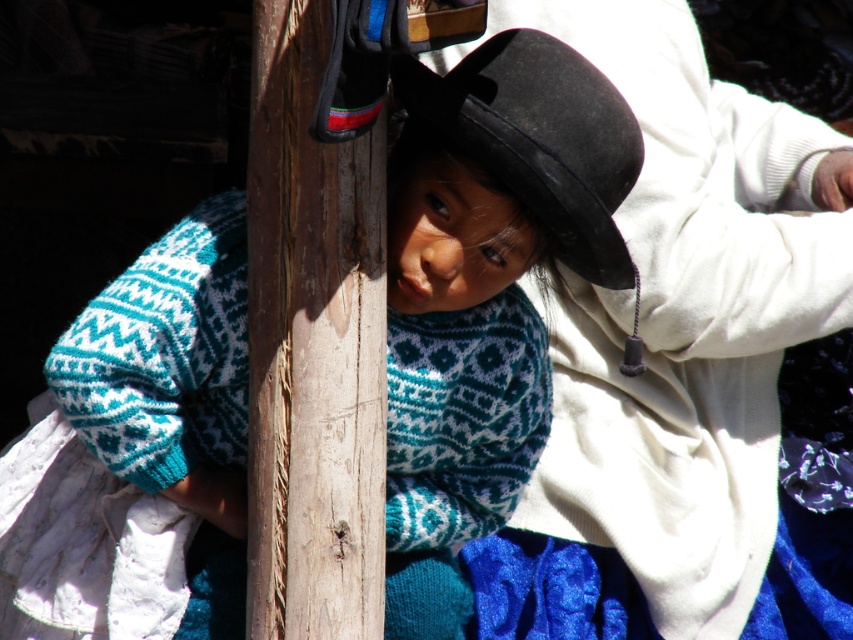
Is knitted wool sweater at center bigger than wooden pole at center?

Yes, knitted wool sweater at center is bigger than wooden pole at center.

What do you see at coordinates (485, 291) in the screenshot? I see `knitted wool sweater at center` at bounding box center [485, 291].

Locate an element on the screen. Image resolution: width=853 pixels, height=640 pixels. knitted wool sweater at center is located at coordinates (485, 291).

Based on the photo, is wooden pole at center below black felt hat at center?

Yes, wooden pole at center is below black felt hat at center.

Is wooden pole at center smaller than black felt hat at center?

Incorrect, wooden pole at center is not smaller in size than black felt hat at center.

Describe the element at coordinates (312, 346) in the screenshot. I see `wooden pole at center` at that location.

Where is `wooden pole at center`? wooden pole at center is located at coordinates (312, 346).

Does point (183, 358) come farther from viewer compared to point (581, 72)?

That is True.

Does knitted wool sweater at center have a greater height compared to black felt hat at center?

Correct, knitted wool sweater at center is much taller as black felt hat at center.

Is point (485, 362) farther from viewer compared to point (457, 100)?

Yes, point (485, 362) is farther from viewer.

At what (x,y) coordinates should I click in order to perform the action: click on knitted wool sweater at center. Please return your answer as a coordinate pair (x, y). The height and width of the screenshot is (640, 853). Looking at the image, I should click on (485, 291).